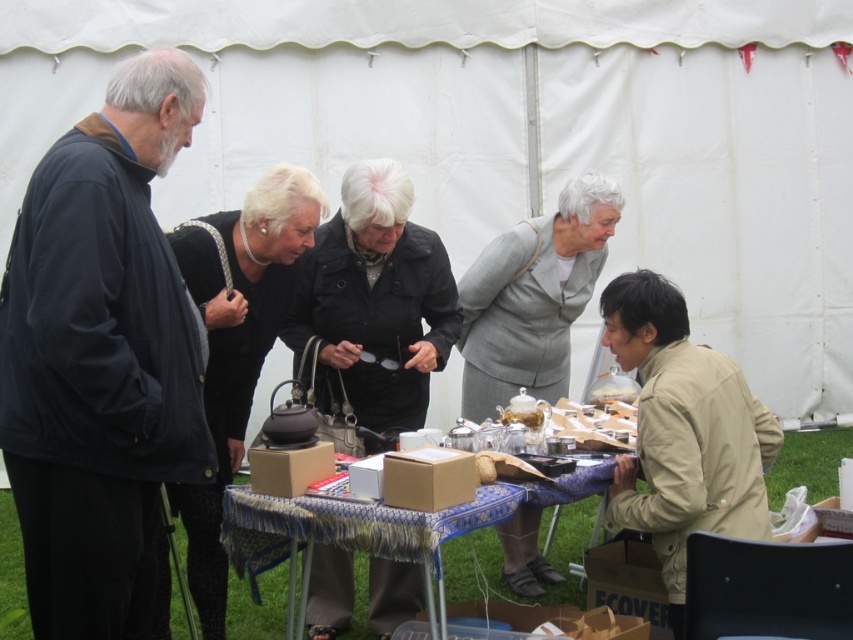
From the picture: Between black fabric jacket at left and black leather jacket at center, which one is positioned higher?

Positioned higher is black leather jacket at center.

Is point (59, 336) positioned before point (378, 320)?

That is True.

Does point (187, 326) lie behind point (396, 298)?

No, (187, 326) is closer to viewer.

Identify the location of black fabric jacket at left. The width and height of the screenshot is (853, 640). tap(102, 356).

Can you confirm if black matte teapot at center is positioned to the right of blue fabric table at center?

No, black matte teapot at center is not to the right of blue fabric table at center.

Between black matte teapot at center and blue fabric table at center, which one appears on the left side from the viewer's perspective?

Positioned to the left is black matte teapot at center.

At what (x,y) coordinates should I click in order to perform the action: click on black matte teapot at center. Please return your answer as a coordinate pair (x, y). Looking at the image, I should click on (236, 342).

Between tan fabric jacket at lower right and black matte teapot at center, which one appears on the right side from the viewer's perspective?

From the viewer's perspective, tan fabric jacket at lower right appears more on the right side.

Is point (718, 502) positioned after point (238, 397)?

That is False.

Measure the distance between point (703, 403) and camera.

A distance of 2.92 meters exists between point (703, 403) and camera.

Image resolution: width=853 pixels, height=640 pixels. In order to click on tan fabric jacket at lower right in this screenshot , I will do `click(683, 432)`.